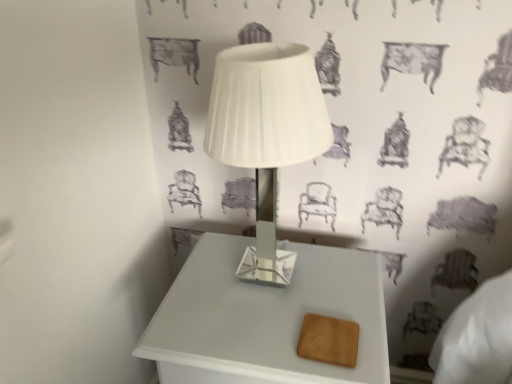
Describe the element at coordinates (264, 317) in the screenshot. The height and width of the screenshot is (384, 512). I see `white glossy table at center` at that location.

Identify the location of white glossy table at center. (264, 317).

The height and width of the screenshot is (384, 512). Describe the element at coordinates (266, 130) in the screenshot. I see `white glossy lamp at center` at that location.

Where is `white glossy lamp at center`? The width and height of the screenshot is (512, 384). white glossy lamp at center is located at coordinates (266, 130).

You are a GUI agent. You are given a task and a screenshot of the screen. Output one action in this format:
    pyautogui.click(x=<x>, y=<y>)
    Task: Click on the white glossy table at center
    This screenshot has height=384, width=512.
    Given the screenshot: What is the action you would take?
    pyautogui.click(x=264, y=317)

Based on the photo, visually, is white glossy table at center positioned to the left or to the right of white glossy lamp at center?

In the image, white glossy table at center appears on the right side of white glossy lamp at center.

Considering the positions of objects white glossy table at center and white glossy lamp at center in the image provided, who is behind, white glossy table at center or white glossy lamp at center?

white glossy table at center is behind.

Is point (219, 305) closer or farther from the camera than point (270, 170)?

Point (219, 305) is closer to the camera than point (270, 170).

From the image's perspective, is white glossy table at center beneath white glossy lamp at center?

Correct, white glossy table at center appears lower than white glossy lamp at center in the image.

From a real-world perspective, is white glossy table at center beneath white glossy lamp at center?

Yes, from a real-world perspective, white glossy table at center is under white glossy lamp at center.

Considering the sizes of objects white glossy table at center and white glossy lamp at center in the image provided, who is wider, white glossy table at center or white glossy lamp at center?

white glossy table at center.

Does white glossy table at center have a greater height compared to white glossy lamp at center?

Indeed, white glossy table at center has a greater height compared to white glossy lamp at center.

Between white glossy table at center and white glossy lamp at center, which one has smaller size?

white glossy lamp at center.

Is white glossy lamp at center surrounded by white glossy table at center?

No, white glossy lamp at center is located outside of white glossy table at center.

Is white glossy table at center far from white glossy lamp at center?

That's not correct — white glossy table at center is a little close to white glossy lamp at center.

Is white glossy table at center looking in the opposite direction of white glossy lamp at center?

white glossy table at center does not have its back to white glossy lamp at center.

What are the coordinates of `table below the white glossy lamp at center (from the image's perspective)` in the screenshot? It's located at (264, 317).

Is white glossy lamp at center to the left or to the right of white glossy table at center in the image?

white glossy lamp at center is positioned on white glossy table at center's left side.

Considering the positions of objects white glossy lamp at center and white glossy table at center in the image provided, who is behind, white glossy lamp at center or white glossy table at center?

white glossy table at center.

Which is in front, point (298, 45) or point (234, 342)?

Positioned in front is point (298, 45).

From the image's perspective, relative to white glossy table at center, is white glossy lamp at center above or below?

white glossy lamp at center is situated higher than white glossy table at center in the image.

From a real-world perspective, is white glossy lamp at center positioned above or below white glossy table at center?

From a real-world perspective, white glossy lamp at center is physically above white glossy table at center.

Considering the relative sizes of white glossy lamp at center and white glossy table at center in the image provided, is white glossy lamp at center wider than white glossy table at center?

No.

Considering the relative sizes of white glossy lamp at center and white glossy table at center in the image provided, is white glossy lamp at center taller than white glossy table at center?

In fact, white glossy lamp at center may be shorter than white glossy table at center.

Does white glossy lamp at center have a smaller size compared to white glossy table at center?

Indeed, white glossy lamp at center has a smaller size compared to white glossy table at center.

Is white glossy lamp at center situated inside white glossy table at center or outside?

white glossy lamp at center cannot be found inside white glossy table at center.

Is white glossy lamp at center not close to white glossy table at center?

white glossy lamp at center is actually quite close to white glossy table at center.

Could you tell me if white glossy lamp at center is turned towards white glossy table at center?

No, white glossy lamp at center does not turn towards white glossy table at center.

Image resolution: width=512 pixels, height=384 pixels. I want to click on lamp on the left of white glossy table at center, so click(266, 130).

Find the location of a particular element. The image size is (512, 384). lamp that is on the left side of white glossy table at center is located at coordinates (266, 130).

Locate an element on the screen. table below the white glossy lamp at center (from a real-world perspective) is located at coordinates (264, 317).